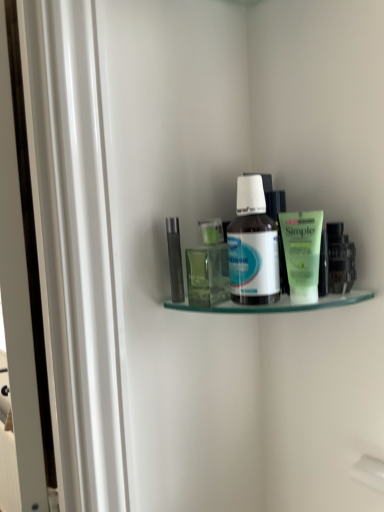
At what (x,y) coordinates should I click in order to perform the action: click on green matte tube at right, the 4th toiletry positioned from the left. Please return your answer as a coordinate pair (x, y). Looking at the image, I should click on (340, 259).

What do you see at coordinates (208, 267) in the screenshot?
I see `translucent plastic bottle at center, the 2th toiletry from the left` at bounding box center [208, 267].

Locate an element on the screen. This screenshot has width=384, height=512. translucent plastic bottle at center, which ranks as the 3th toiletry in right-to-left order is located at coordinates (208, 267).

Measure the distance between point (313,249) and camera.

The depth of point (313,249) is 20.71 inches.

Image resolution: width=384 pixels, height=512 pixels. What are the coordinates of `clear glass shelf at upper center` in the screenshot? It's located at (276, 304).

Does green matte tube at upper right, which is the second toiletry in right-to-left order, turn towards translucent plastic bottle at center, which ranks as the 3th toiletry in right-to-left order?

No, green matte tube at upper right, which is the second toiletry in right-to-left order, is not aimed at translucent plastic bottle at center, which ranks as the 3th toiletry in right-to-left order.

Considering the positions of points (314, 277) and (222, 298), is point (314, 277) closer to camera compared to point (222, 298)?

Yes, it is.

What are the coordinates of `toiletry that is the 1st one when counting leftward from the green matte tube at upper right, which is the second toiletry in right-to-left order` in the screenshot? It's located at (208, 267).

From a real-world perspective, relative to translucent plastic bottle at center, which ranks as the 3th toiletry in right-to-left order, is green matte tube at upper right, which is the second toiletry in right-to-left order, vertically above or below?

From a real-world perspective, green matte tube at upper right, which is the second toiletry in right-to-left order, is physically above translucent plastic bottle at center, which ranks as the 3th toiletry in right-to-left order.

Who is smaller, green matte tube at right, the 4th toiletry positioned from the left, or white glossy bottle at center?

Smaller between the two is green matte tube at right, the 4th toiletry positioned from the left.

Which is less distant, (331, 252) or (251, 278)?

The point (251, 278) is more forward.

Is green matte tube at right, which ranks as the first toiletry in right-to-left order, oriented away from white glossy bottle at center?

No, green matte tube at right, which ranks as the first toiletry in right-to-left order, is not facing away from white glossy bottle at center.

Do you think green matte tube at right, which ranks as the first toiletry in right-to-left order, is within white glossy bottle at center, or outside of it?

green matte tube at right, which ranks as the first toiletry in right-to-left order, exists outside the volume of white glossy bottle at center.

Does transparent plastic bottle at center, the 1th toiletry in the left-to-right sequence, have a lesser width compared to green matte tube at right, the 4th toiletry positioned from the left?

Yes.

Is transparent plastic bottle at center, the 1th toiletry in the left-to-right sequence, far away from green matte tube at right, which ranks as the first toiletry in right-to-left order?

They are positioned close to each other.

Between transparent plastic bottle at center, the 1th toiletry in the left-to-right sequence, and green matte tube at right, the 4th toiletry positioned from the left, which one appears on the left side from the viewer's perspective?

Positioned to the left is transparent plastic bottle at center, the 1th toiletry in the left-to-right sequence.

Between clear glass shelf at upper center and translucent plastic bottle at center, which ranks as the 3th toiletry in right-to-left order, which one is positioned in front?

clear glass shelf at upper center.

Does clear glass shelf at upper center have a greater width compared to translucent plastic bottle at center, the 2th toiletry from the left?

Yes, clear glass shelf at upper center is wider than translucent plastic bottle at center, the 2th toiletry from the left.

Which is further, [220,311] or [209,230]?

The point [220,311] is behind.

Is clear glass shelf at upper center facing away from translucent plastic bottle at center, the 2th toiletry from the left?

No.

Where is `bottle that appears above the green matte tube at right, the 4th toiletry positioned from the left (from the image's perspective)`? Image resolution: width=384 pixels, height=512 pixels. bottle that appears above the green matte tube at right, the 4th toiletry positioned from the left (from the image's perspective) is located at coordinates (253, 247).

How distant is white glossy bottle at center from green matte tube at right, which ranks as the first toiletry in right-to-left order?

The distance of white glossy bottle at center from green matte tube at right, which ranks as the first toiletry in right-to-left order, is 4.36 inches.

From a real-world perspective, is white glossy bottle at center on top of green matte tube at right, the 4th toiletry positioned from the left?

Yes.

Is green matte tube at right, the 4th toiletry positioned from the left, inside white glossy bottle at center?

Definitely not — green matte tube at right, the 4th toiletry positioned from the left, is not inside white glossy bottle at center.

Could you tell me if translucent plastic bottle at center, the 2th toiletry from the left, is facing green matte tube at upper right, which is the second toiletry in right-to-left order?

No, translucent plastic bottle at center, the 2th toiletry from the left, does not turn towards green matte tube at upper right, which is the second toiletry in right-to-left order.

What's the angular difference between translucent plastic bottle at center, which ranks as the 3th toiletry in right-to-left order, and green matte tube at upper right, which is the second toiletry in right-to-left order,'s facing directions?

The angle between the facing direction of translucent plastic bottle at center, which ranks as the 3th toiletry in right-to-left order, and the facing direction of green matte tube at upper right, which is the second toiletry in right-to-left order, is 28.4 degrees.

From a real-world perspective, which toiletry is the 2nd one underneath the green matte tube at upper right, which is the second toiletry in right-to-left order? Please provide its 2D coordinates.

[(208, 267)]

In the scene shown: Which is nearer, (195,270) or (292,216)?

Point (195,270) is farther from the camera than point (292,216).

Is green matte tube at upper right, which is the second toiletry in right-to-left order, far away from transparent plastic bottle at center, arranged as the fourth toiletry when viewed from the right?

No, green matte tube at upper right, which is the second toiletry in right-to-left order, is in close proximity to transparent plastic bottle at center, arranged as the fourth toiletry when viewed from the right.

Is green matte tube at upper right, marked as the 3th toiletry in a left-to-right arrangement, turned away from transparent plastic bottle at center, arranged as the fourth toiletry when viewed from the right?

No, green matte tube at upper right, marked as the 3th toiletry in a left-to-right arrangement, is not facing away from transparent plastic bottle at center, arranged as the fourth toiletry when viewed from the right.

Is green matte tube at upper right, marked as the 3th toiletry in a left-to-right arrangement, bigger than transparent plastic bottle at center, the 1th toiletry in the left-to-right sequence?

Yes.

How different are the orientations of green matte tube at upper right, which is the second toiletry in right-to-left order, and transparent plastic bottle at center, arranged as the fourth toiletry when viewed from the right, in degrees?

The angular difference between green matte tube at upper right, which is the second toiletry in right-to-left order, and transparent plastic bottle at center, arranged as the fourth toiletry when viewed from the right, is 28.4 degrees.

Identify the location of the 3rd toiletry below when counting from the green matte tube at upper right, marked as the 3th toiletry in a left-to-right arrangement (from the image's perspective). (208, 267).

Where is `bottle that is above the green matte tube at right, the 4th toiletry positioned from the left (from a real-world perspective)`? bottle that is above the green matte tube at right, the 4th toiletry positioned from the left (from a real-world perspective) is located at coordinates (253, 247).

When comparing their distances from translucent plastic bottle at center, which ranks as the 3th toiletry in right-to-left order, does transparent plastic bottle at center, the 1th toiletry in the left-to-right sequence, or white glossy bottle at center seem closer?

transparent plastic bottle at center, the 1th toiletry in the left-to-right sequence, is closer to translucent plastic bottle at center, which ranks as the 3th toiletry in right-to-left order.

From the image, which object appears to be nearer to transparent plastic bottle at center, the 1th toiletry in the left-to-right sequence, green matte tube at upper right, which is the second toiletry in right-to-left order, or translucent plastic bottle at center, the 2th toiletry from the left?

translucent plastic bottle at center, the 2th toiletry from the left, is closer to transparent plastic bottle at center, the 1th toiletry in the left-to-right sequence.

Looking at the image, which one is located closer to green matte tube at upper right, which is the second toiletry in right-to-left order, translucent plastic bottle at center, which ranks as the 3th toiletry in right-to-left order, or clear glass shelf at upper center?

The object closer to green matte tube at upper right, which is the second toiletry in right-to-left order, is clear glass shelf at upper center.

Estimate the real-world distances between objects in this image. Which object is further from translucent plastic bottle at center, which ranks as the 3th toiletry in right-to-left order, white glossy bottle at center or green matte tube at upper right, marked as the 3th toiletry in a left-to-right arrangement?

green matte tube at upper right, marked as the 3th toiletry in a left-to-right arrangement.

Based on their spatial positions, is clear glass shelf at upper center or translucent plastic bottle at center, the 2th toiletry from the left, closer to green matte tube at right, which ranks as the first toiletry in right-to-left order?

Among the two, clear glass shelf at upper center is located nearer to green matte tube at right, which ranks as the first toiletry in right-to-left order.

Which object lies further to the anchor point green matte tube at right, which ranks as the first toiletry in right-to-left order, white glossy bottle at center or transparent plastic bottle at center, the 1th toiletry in the left-to-right sequence?

Among the two, transparent plastic bottle at center, the 1th toiletry in the left-to-right sequence, is located further to green matte tube at right, which ranks as the first toiletry in right-to-left order.

Based on their spatial positions, is clear glass shelf at upper center or white glossy bottle at center closer to translucent plastic bottle at center, which ranks as the 3th toiletry in right-to-left order?

The object closer to translucent plastic bottle at center, which ranks as the 3th toiletry in right-to-left order, is white glossy bottle at center.

Looking at the image, which one is located closer to clear glass shelf at upper center, green matte tube at right, which ranks as the first toiletry in right-to-left order, or translucent plastic bottle at center, the 2th toiletry from the left?

Among the two, translucent plastic bottle at center, the 2th toiletry from the left, is located nearer to clear glass shelf at upper center.

Where is `toiletry between transparent plastic bottle at center, arranged as the fourth toiletry when viewed from the right, and white glossy bottle at center, in the horizontal direction`? toiletry between transparent plastic bottle at center, arranged as the fourth toiletry when viewed from the right, and white glossy bottle at center, in the horizontal direction is located at coordinates click(208, 267).

In order to click on bottle located between transparent plastic bottle at center, arranged as the fourth toiletry when viewed from the right, and clear glass shelf at upper center in the left-right direction in this screenshot , I will do `click(253, 247)`.

Find the location of `toiletry between translucent plastic bottle at center, the 2th toiletry from the left, and green matte tube at right, which ranks as the first toiletry in right-to-left order`. toiletry between translucent plastic bottle at center, the 2th toiletry from the left, and green matte tube at right, which ranks as the first toiletry in right-to-left order is located at coordinates (302, 253).

At what (x,y) coordinates should I click in order to perform the action: click on shelf between translucent plastic bottle at center, the 2th toiletry from the left, and green matte tube at right, the 4th toiletry positioned from the left. Please return your answer as a coordinate pair (x, y). Looking at the image, I should click on (276, 304).